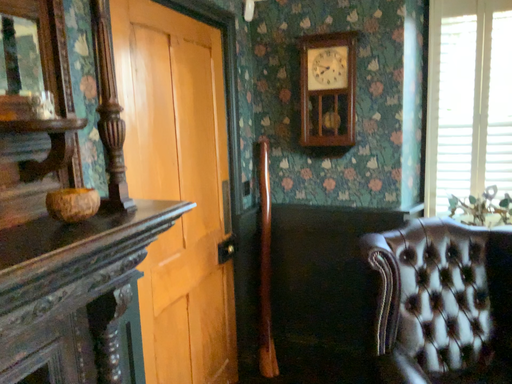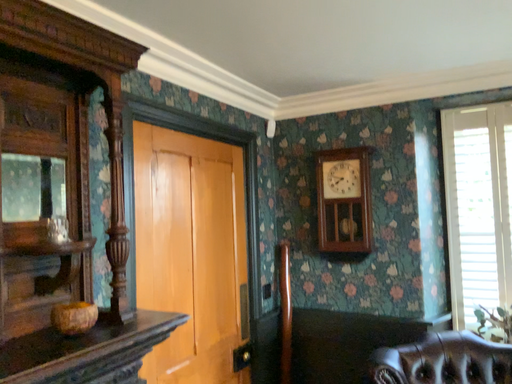
Question: How did the camera likely rotate when shooting the video?

Choices:
 (A) rotated downward
 (B) rotated upward

Answer: (B)